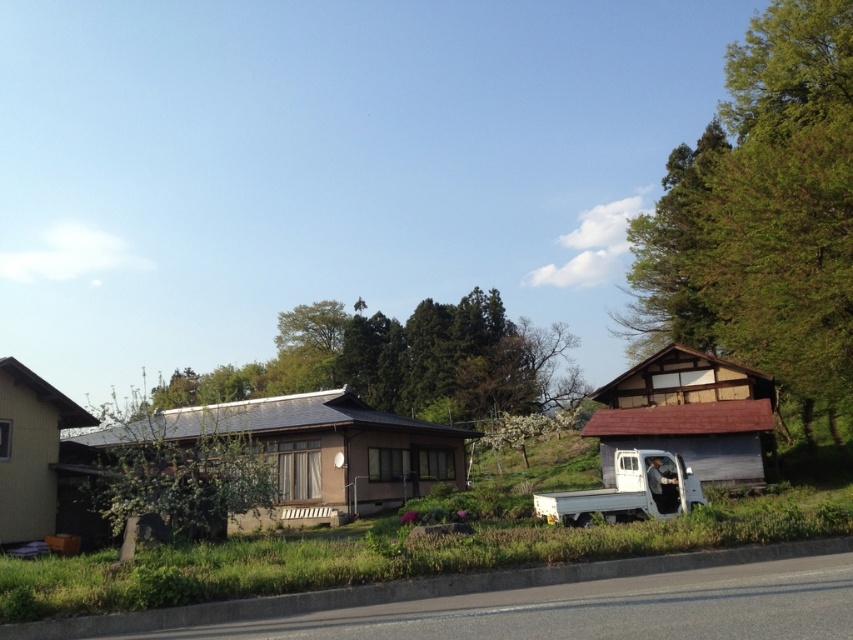
Who is taller, green leafy tree at right or green leafy tree at center?

green leafy tree at right

Does point (824, 330) come closer to viewer compared to point (120, 461)?

No, (824, 330) is further to viewer.

This screenshot has width=853, height=640. What are the coordinates of `green leafy tree at right` in the screenshot? It's located at (763, 212).